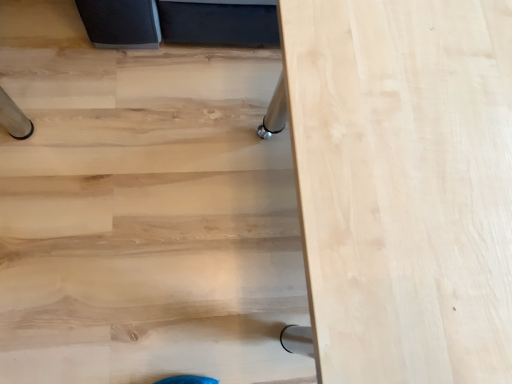
Question: Based on their positions, is light wood table at lower right located to the left or right of natural wood table at center?

Choices:
 (A) right
 (B) left

Answer: (B)

Question: Is light wood table at lower right inside the boundaries of natural wood table at center, or outside?

Choices:
 (A) outside
 (B) inside

Answer: (A)

Question: From the image's perspective, is light wood table at lower right located above or below natural wood table at center?

Choices:
 (A) below
 (B) above

Answer: (B)

Question: From the image's perspective, is natural wood table at center positioned above or below light wood table at lower right?

Choices:
 (A) above
 (B) below

Answer: (B)

Question: Considering the positions of natural wood table at center and light wood table at lower right in the image, is natural wood table at center taller or shorter than light wood table at lower right?

Choices:
 (A) short
 (B) tall

Answer: (B)

Question: Considering the positions of point (464, 155) and point (95, 167), is point (464, 155) closer or farther from the camera than point (95, 167)?

Choices:
 (A) farther
 (B) closer

Answer: (B)

Question: Is natural wood table at center in front of or behind light wood table at lower right in the image?

Choices:
 (A) front
 (B) behind

Answer: (A)